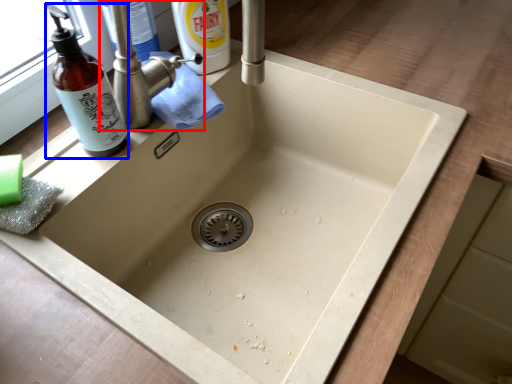
Question: Among these objects, which one is nearest to the camera, tap (highlighted by a red box) or bottle (highlighted by a blue box)?

Choices:
 (A) tap
 (B) bottle

Answer: (B)